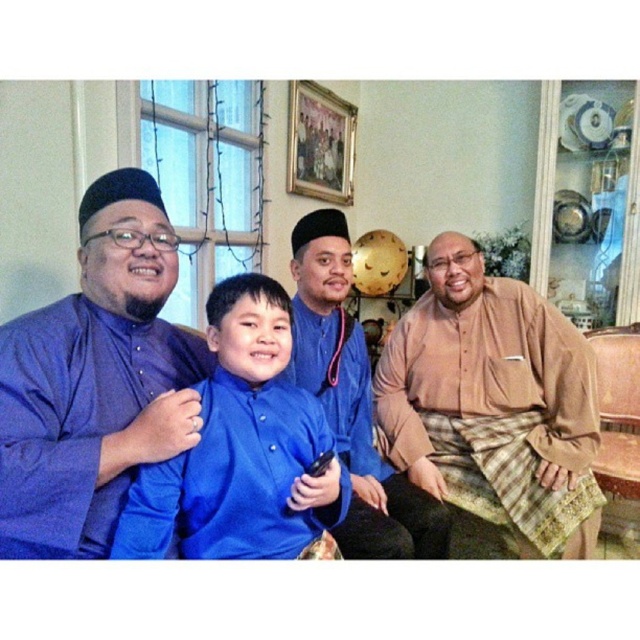
Question: Which point is closer to the camera?

Choices:
 (A) (116, 225)
 (B) (241, 522)
 (C) (449, 394)

Answer: (B)

Question: Which is nearer to the matte blue kurta at left?

Choices:
 (A) matte blue kurta at center
 (B) blue satin shirt at center
 (C) blue satin kurta at center
 (D) beige textured shirt at right

Answer: (C)

Question: Which of the following is the closest to the observer?

Choices:
 (A) matte blue kurta at center
 (B) matte blue kurta at left
 (C) blue satin kurta at center
 (D) blue satin shirt at center

Answer: (B)

Question: Is blue satin shirt at center smaller than matte blue kurta at center?

Choices:
 (A) no
 (B) yes

Answer: (B)

Question: Can you confirm if blue satin shirt at center is smaller than matte blue kurta at center?

Choices:
 (A) yes
 (B) no

Answer: (A)

Question: Can you confirm if blue satin kurta at center is positioned above matte blue kurta at left?

Choices:
 (A) no
 (B) yes

Answer: (B)